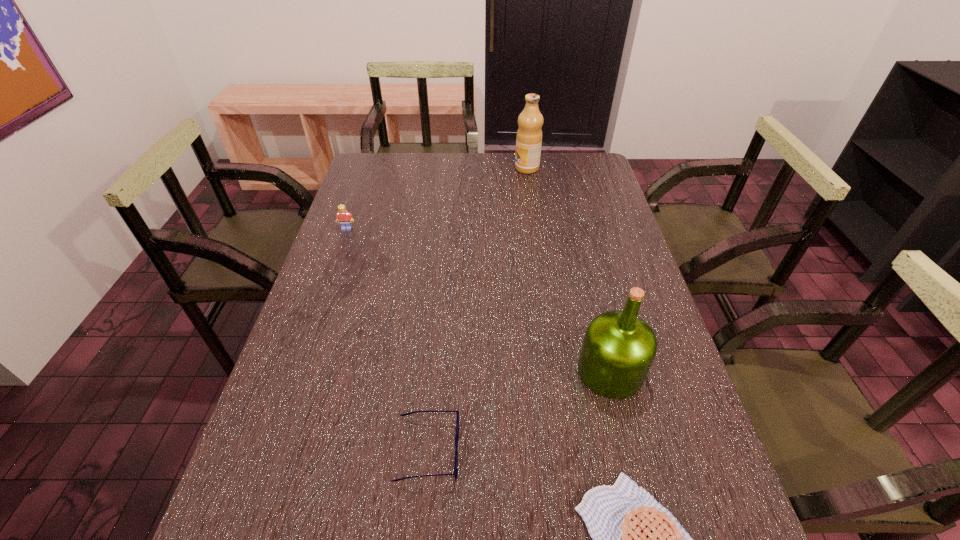
This screenshot has height=540, width=960. What are the coordinates of `free space at the far right corner of the desktop` in the screenshot? It's located at (580, 157).

Identify the location of vacant area that lies between the second object from left to right and the third tallest object. (387, 339).

Identify the location of empty space that is in between the second object from left to right and the second farthest object. (387, 339).

The width and height of the screenshot is (960, 540). In order to click on free space that is in between the farthest object and the second farthest object in this screenshot , I will do `click(437, 198)`.

At what (x,y) coordinates should I click in order to perform the action: click on free spot between the Lego and the third nearest object. Please return your answer as a coordinate pair (x, y). The width and height of the screenshot is (960, 540). Looking at the image, I should click on (479, 300).

Find the location of a particular element. The width and height of the screenshot is (960, 540). vacant area that lies between the third farthest object and the third shortest object is located at coordinates (479, 300).

Locate an element on the screen. vacant point located between the leftmost object and the left olive oil is located at coordinates (437, 198).

Find the location of `free space between the farther olive oil and the third tallest object`. free space between the farther olive oil and the third tallest object is located at coordinates (437, 198).

Find the location of a particular element. This screenshot has height=540, width=960. the second closest object to the left olive oil is located at coordinates (619, 347).

Locate an element on the screen. This screenshot has width=960, height=540. object identified as the third closest to the leftmost object is located at coordinates (619, 347).